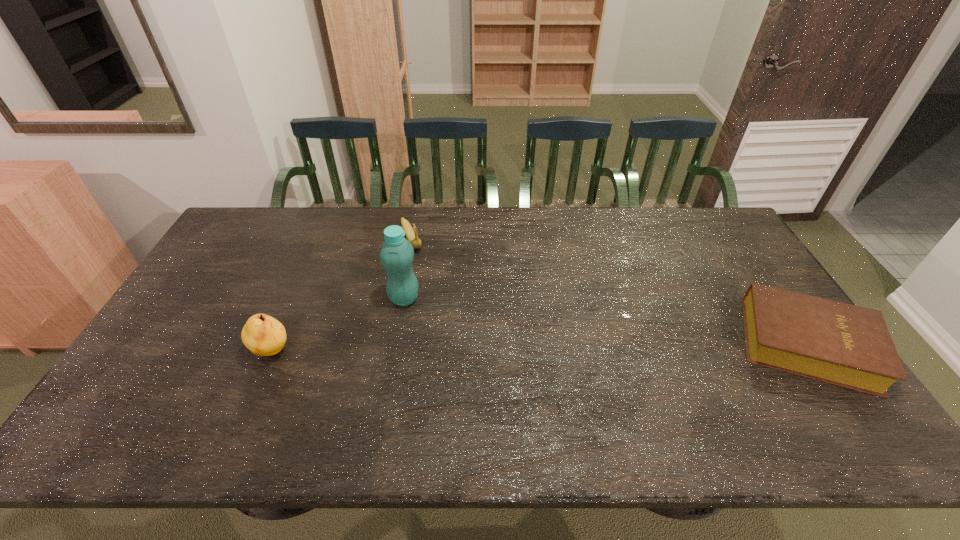
In the image, there is a desktop. Identify the location of blank space at the near edge. (267, 407).

Identify the location of free space at the left edge of the desktop. This screenshot has width=960, height=540. [201, 276].

Identify the location of free region at the right edge of the desktop. (709, 259).

In the image, there is a desktop. Where is `free region at the far left corner`? This screenshot has height=540, width=960. free region at the far left corner is located at coordinates (244, 213).

In the image, there is a desktop. Find the location of `free space at the far right corner`. free space at the far right corner is located at coordinates (737, 244).

Locate an element on the screen. free area in between the third shortest object and the farthest object is located at coordinates (342, 295).

The image size is (960, 540). Identify the location of vacant area between the banana and the leftmost object. (342, 295).

This screenshot has width=960, height=540. I want to click on empty location between the Bible and the tallest object, so click(606, 321).

Locate an element on the screen. free spot between the Bible and the banana is located at coordinates (610, 291).

You are a GUI agent. You are given a task and a screenshot of the screen. Output one action in this format:
    pyautogui.click(x=<x>, y=<y>)
    Task: Click on the vacant area that lies between the leftmost object and the shortest object
    Image resolution: width=960 pixels, height=540 pixels.
    Given the screenshot: What is the action you would take?
    pyautogui.click(x=540, y=348)